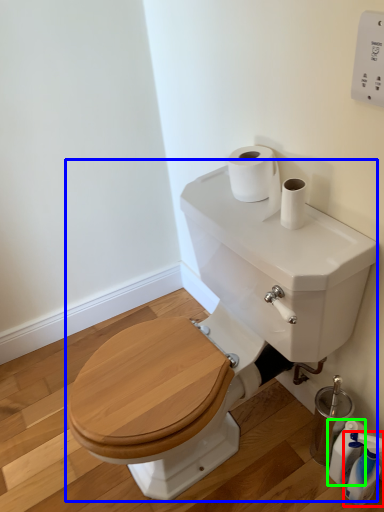
Question: Which object is the closest to the cleaning product (highlighted by a red box)? Choose among these: sink (highlighted by a blue box) or cleaning product (highlighted by a green box).

Choices:
 (A) sink
 (B) cleaning product

Answer: (B)